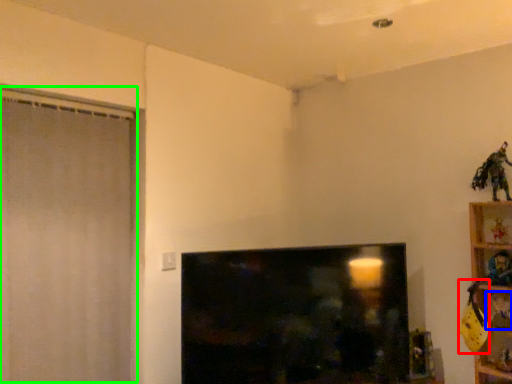
Question: Which object is the farthest from toy (highlighted by a red box)? Choose among these: toy (highlighted by a blue box) or screen door (highlighted by a green box).

Choices:
 (A) toy
 (B) screen door

Answer: (B)